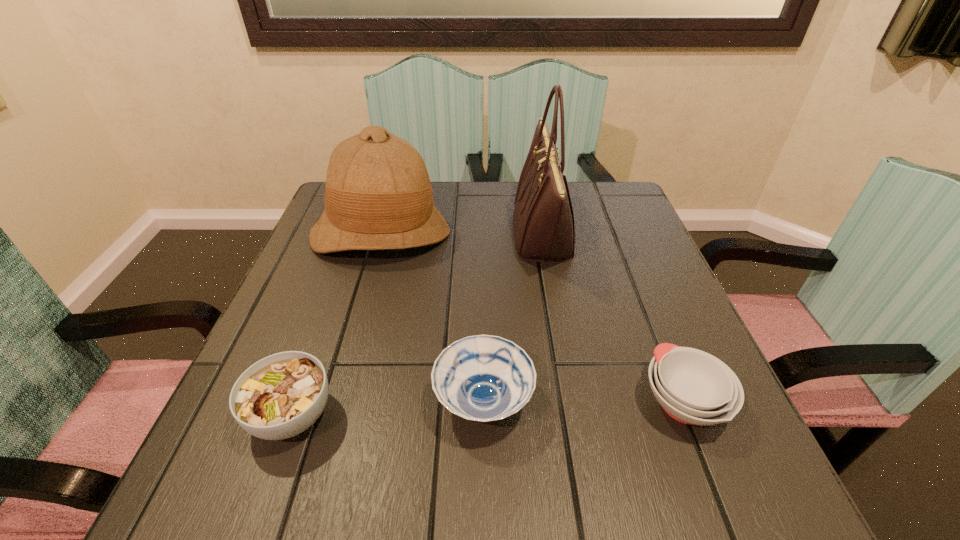
I want to click on vacant space that satisfies the following two spatial constraints: 1. on the front-facing side of the second tallest object; 2. on the left side of the rightmost object, so click(332, 401).

At what (x,y) coordinates should I click in order to perform the action: click on vacant space that satisfies the following two spatial constraints: 1. on the back side of the second soup bowl from left to right; 2. on the right side of the rightmost soup bowl. Please return your answer as a coordinate pair (x, y). The height and width of the screenshot is (540, 960). Looking at the image, I should click on (484, 401).

Image resolution: width=960 pixels, height=540 pixels. Find the location of `vacant space that satisfies the following two spatial constraints: 1. on the front-facing side of the tallest object; 2. on the front side of the leftmost soup bowl`. vacant space that satisfies the following two spatial constraints: 1. on the front-facing side of the tallest object; 2. on the front side of the leftmost soup bowl is located at coordinates (576, 415).

You are a GUI agent. You are given a task and a screenshot of the screen. Output one action in this format:
    pyautogui.click(x=<x>, y=<y>)
    Task: Click on the blank area in the image that satisfies the following two spatial constraints: 1. on the front-facing side of the tallest object; 2. on the left side of the rightmost object
    
    Given the screenshot: What is the action you would take?
    pyautogui.click(x=574, y=401)

Locate an element on the screen. The width and height of the screenshot is (960, 540). vacant space that satisfies the following two spatial constraints: 1. on the front-facing side of the handbag; 2. on the front side of the leftmost soup bowl is located at coordinates (576, 415).

Find the location of a particular element. free spot that satisfies the following two spatial constraints: 1. on the front-facing side of the second tallest object; 2. on the left side of the rightmost object is located at coordinates (332, 401).

The image size is (960, 540). I want to click on vacant space that satisfies the following two spatial constraints: 1. on the front-facing side of the hat; 2. on the left side of the rightmost soup bowl, so click(332, 401).